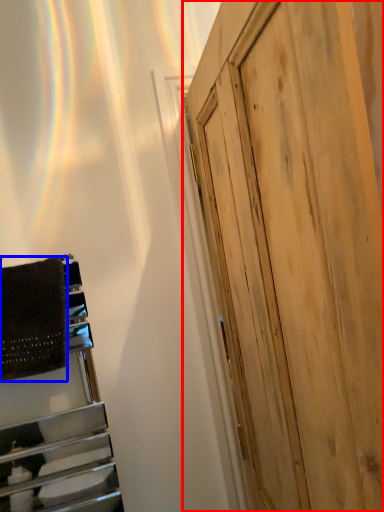
Question: Among these objects, which one is farthest to the camera, door (highlighted by a red box) or blanket (highlighted by a blue box)?

Choices:
 (A) door
 (B) blanket

Answer: (B)